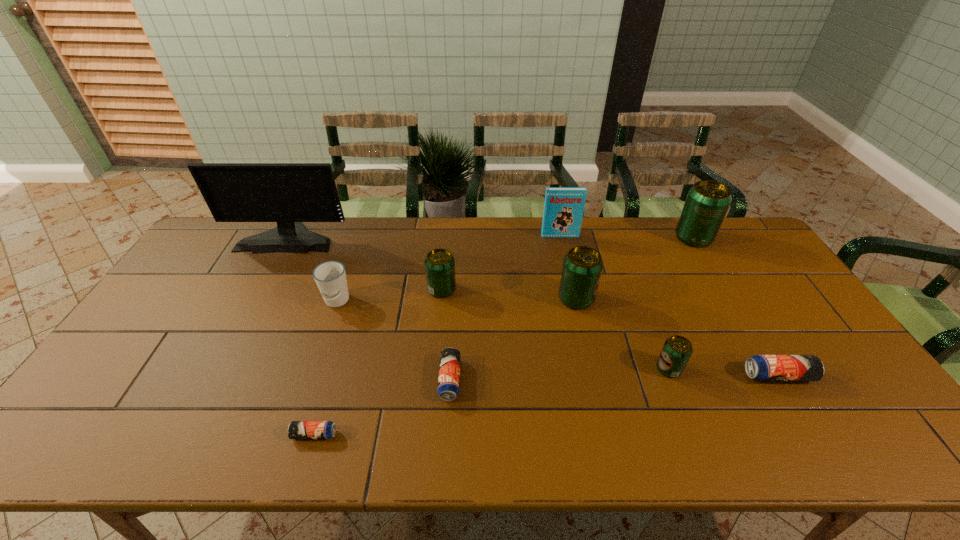
Locate an element on the screen. vacant space that satisfies the following two spatial constraints: 1. on the screen side of the tallest object; 2. on the left side of the eighth object from left to right is located at coordinates (218, 369).